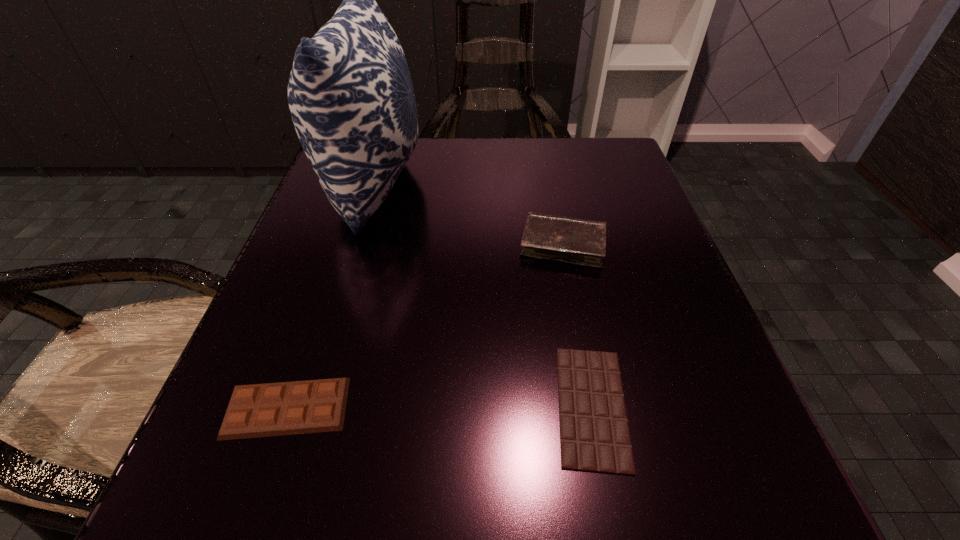
The image size is (960, 540). Identify the location of free space between the left chocolate bar and the second tallest object. (425, 326).

I want to click on vacant area that lies between the shortest object and the third shortest object, so click(x=577, y=325).

Locate an element on the screen. The width and height of the screenshot is (960, 540). empty space between the second shortest object and the cushion is located at coordinates (331, 295).

Locate an element on the screen. vacant area that lies between the tallest object and the diary is located at coordinates (468, 214).

Locate which object ranks in proximity to the second tallest object. Please provide its 2D coordinates. Your answer should be formatted as a tuple, i.e. [(x, y)], where the tuple contains the x and y coordinates of a point satisfying the conditions above.

[(594, 433)]

At what (x,y) coordinates should I click in order to perform the action: click on the second closest object relative to the tallest object. Please return your answer as a coordinate pair (x, y). Looking at the image, I should click on (286, 408).

Where is `free space that satisfies the following two spatial constraints: 1. on the front surface of the diary; 2. on the right side of the cushion`? free space that satisfies the following two spatial constraints: 1. on the front surface of the diary; 2. on the right side of the cushion is located at coordinates (356, 244).

Where is `vacant point that satisfies the following two spatial constraints: 1. on the back side of the shortest object; 2. on the front surface of the tallest object`? The height and width of the screenshot is (540, 960). vacant point that satisfies the following two spatial constraints: 1. on the back side of the shortest object; 2. on the front surface of the tallest object is located at coordinates (548, 183).

Where is `vacant position in the image that satisfies the following two spatial constraints: 1. on the front surface of the tallest object; 2. on the back side of the shortest object`? vacant position in the image that satisfies the following two spatial constraints: 1. on the front surface of the tallest object; 2. on the back side of the shortest object is located at coordinates (307, 406).

The image size is (960, 540). I want to click on blank area in the image that satisfies the following two spatial constraints: 1. on the back side of the shortest object; 2. on the front surface of the tallest object, so [x=548, y=183].